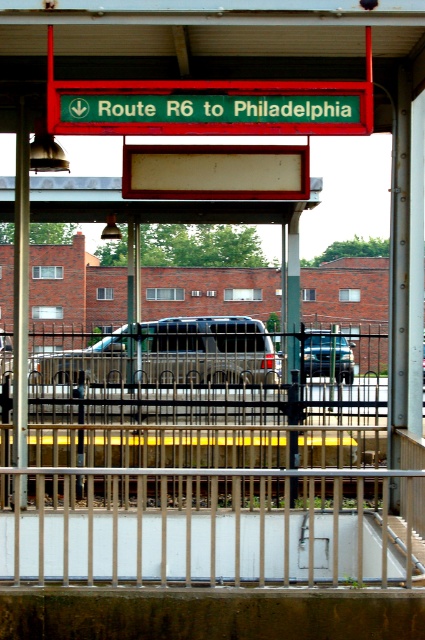
Describe the element at coordinates (170, 355) in the screenshot. I see `silver metallic suv at center` at that location.

Which is behind, point (87, 380) or point (317, 342)?

Positioned behind is point (317, 342).

Is point (272, 372) more distant than point (309, 372)?

No, (272, 372) is in front of (309, 372).

Identify the location of silver metallic suv at center. This screenshot has height=640, width=425. (170, 355).

Is white metal rail at center below metallic silver suv at center?

Correct, white metal rail at center is located below metallic silver suv at center.

Is white metal rail at center behind metallic silver suv at center?

No.

Find the location of a particular element. The height and width of the screenshot is (640, 425). white metal rail at center is located at coordinates (204, 525).

You are a GUI agent. You are given a task and a screenshot of the screen. Output one action in this format:
    pyautogui.click(x=<x>, y=<y>)
    Task: Click on the white metal rail at center
    The image size is (425, 640).
    Given the screenshot: What is the action you would take?
    pyautogui.click(x=204, y=525)

This screenshot has height=640, width=425. I want to click on white metal rail at center, so click(x=204, y=525).

Does white metal rail at center appear on the right side of silver metallic suv at center?

Indeed, white metal rail at center is positioned on the right side of silver metallic suv at center.

Measure the distance between point (118,532) and camera.

29.59 feet

This screenshot has width=425, height=640. I want to click on white metal rail at center, so click(204, 525).